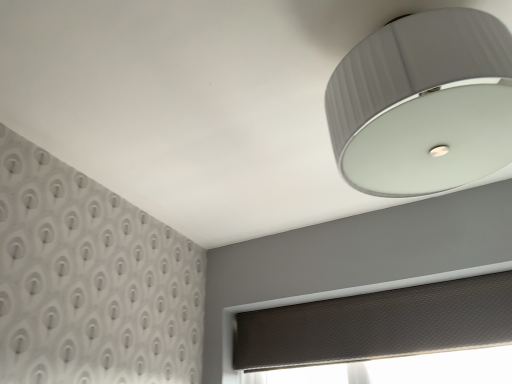
Question: Should I look upward or downward to see matte gray lampshade at upper right?

Choices:
 (A) down
 (B) up

Answer: (B)